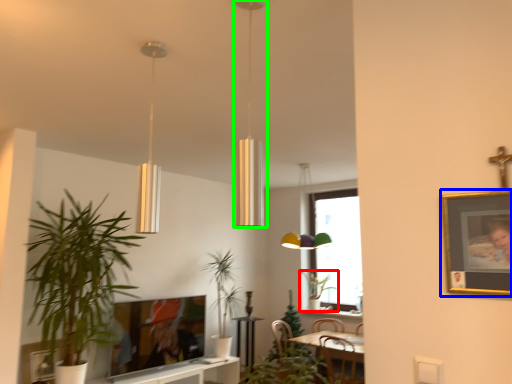
Question: Which object is the farthest from houseplant (highlighted by a red box)? Choose among these: picture frame (highlighted by a blue box) or lamp (highlighted by a green box).

Choices:
 (A) picture frame
 (B) lamp

Answer: (A)